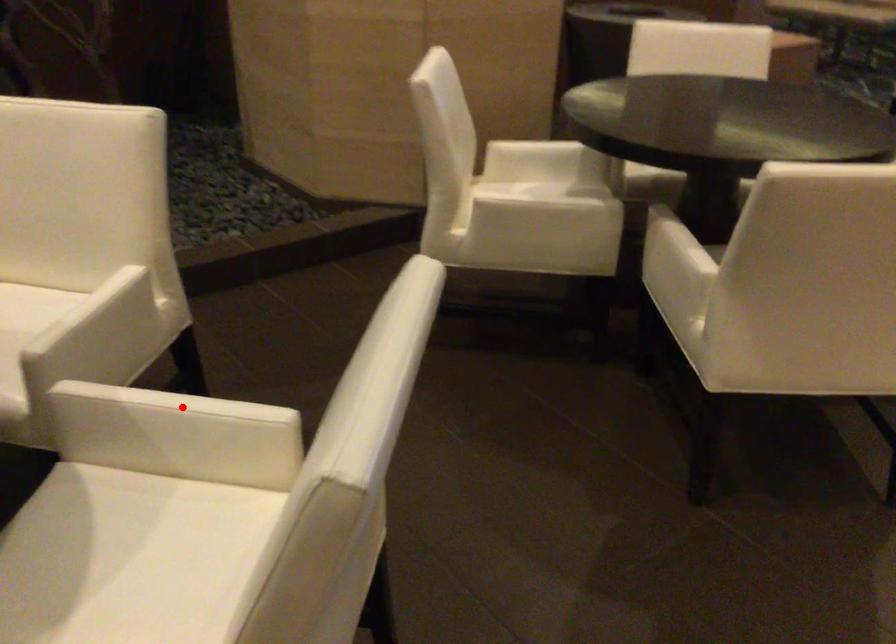
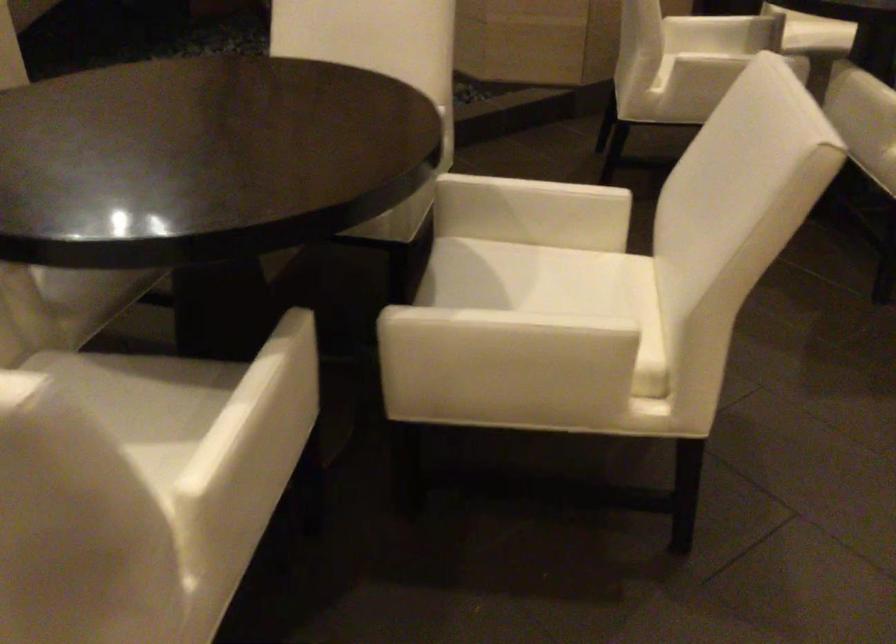
Question: I am providing you with two images of the same scene from different viewpoints. Given a red point in image1, look at the same physical point in image2. Is it:

Choices:
 (A) Closer to the viewpoint
 (B) Farther from the viewpoint

Answer: (B)